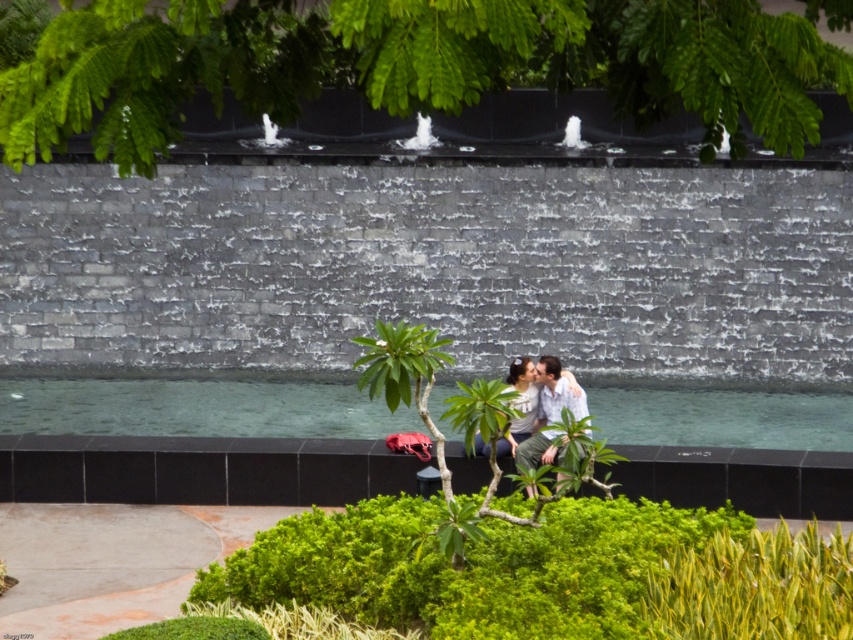
Question: Which point is closer to the camera?

Choices:
 (A) (473, 60)
 (B) (518, 369)

Answer: (A)

Question: Does green leafy tree at upper center appear over matte white shirt at center?

Choices:
 (A) yes
 (B) no

Answer: (A)

Question: Is green leafy tree at upper center above matte white shirt at center?

Choices:
 (A) no
 (B) yes

Answer: (B)

Question: Does green leafy tree at upper center appear under matte white shirt at center?

Choices:
 (A) yes
 (B) no

Answer: (B)